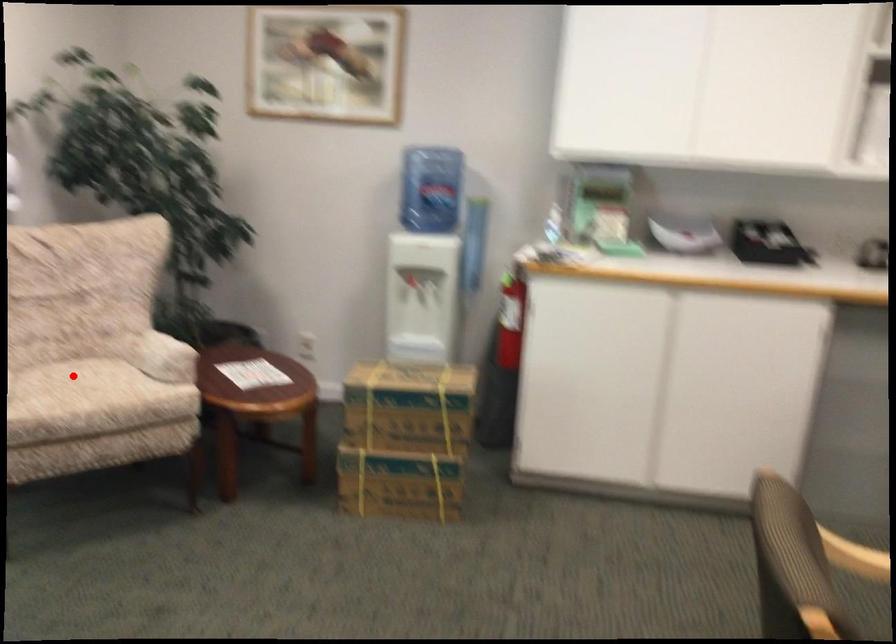
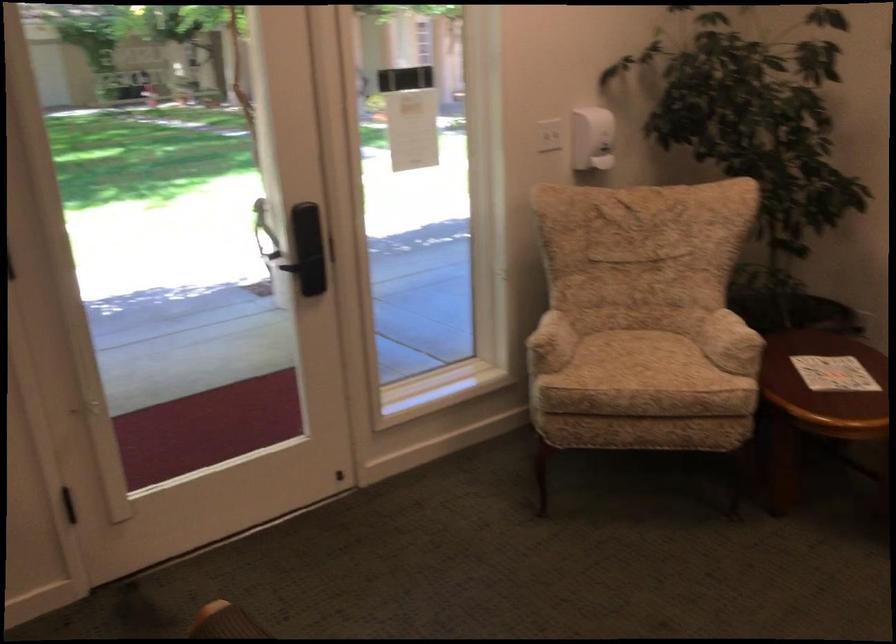
Where in the second image is the point corresponding to the highlighted location from the first image?

(631, 346)